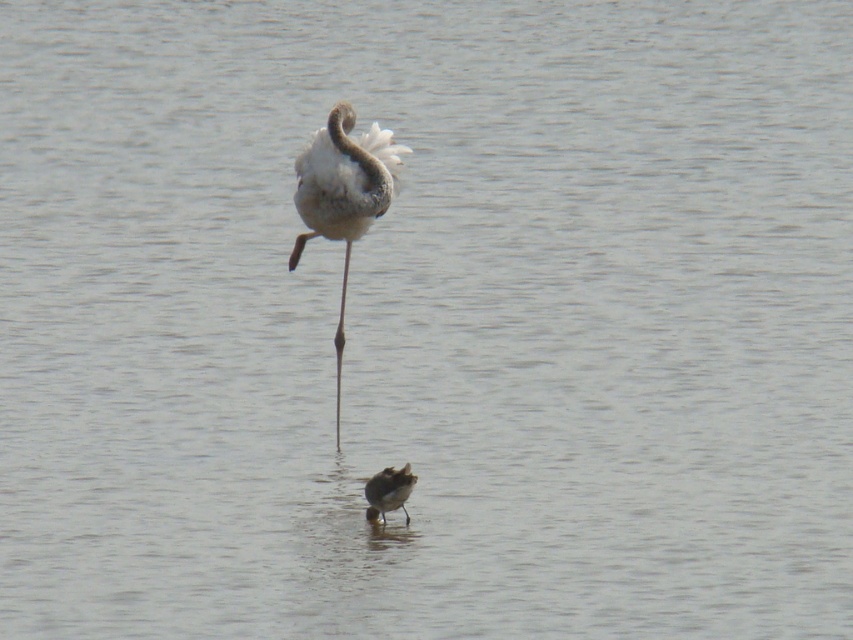
Question: Considering the relative positions of white feathered bird at center and brown speckled sandpiper at lower center in the image provided, where is white feathered bird at center located with respect to brown speckled sandpiper at lower center?

Choices:
 (A) right
 (B) left

Answer: (B)

Question: Among these points, which one is nearest to the camera?

Choices:
 (A) (300, 250)
 (B) (376, 506)

Answer: (B)

Question: Is white feathered bird at center smaller than brown speckled sandpiper at lower center?

Choices:
 (A) yes
 (B) no

Answer: (B)

Question: Is white feathered bird at center wider than brown speckled sandpiper at lower center?

Choices:
 (A) yes
 (B) no

Answer: (A)

Question: Which point is farther from the camera taking this photo?

Choices:
 (A) (378, 483)
 (B) (350, 198)

Answer: (B)

Question: Which point is closer to the camera taking this photo?

Choices:
 (A) (397, 483)
 (B) (331, 237)

Answer: (A)